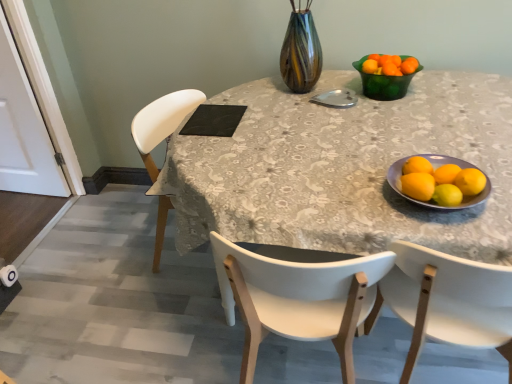
Where is `free spot in front of green translucent bowl at upper right`? This screenshot has height=384, width=512. free spot in front of green translucent bowl at upper right is located at coordinates (402, 112).